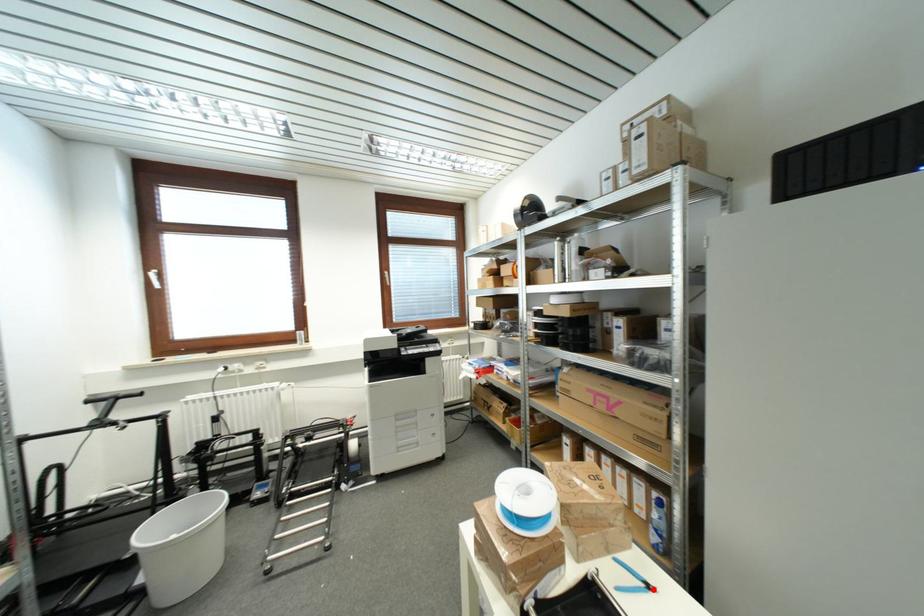
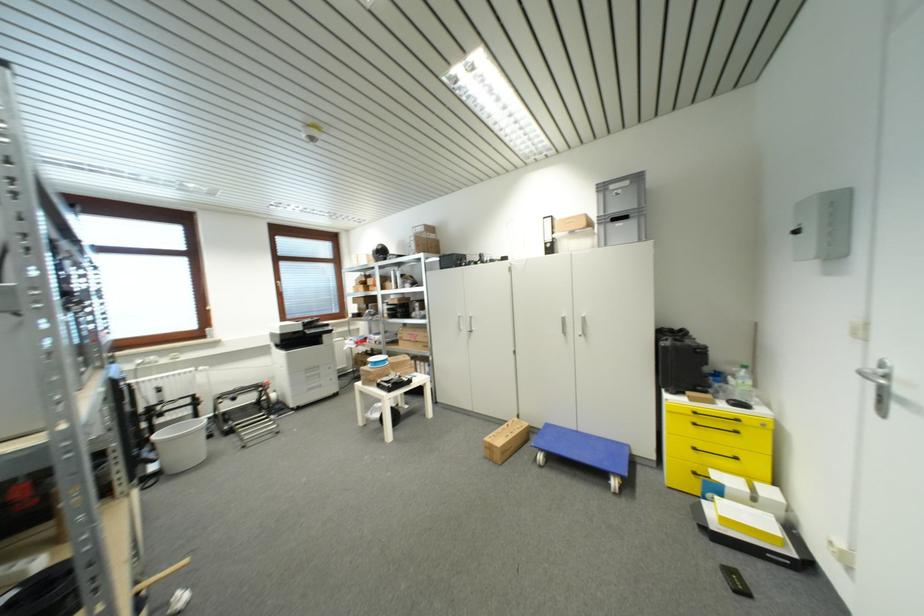
Question: I am providing you with two images of the same scene from different viewpoints. A red point is marked on the first image. Is the red point's position out of view in image 2?

Choices:
 (A) Yes
 (B) No

Answer: (A)